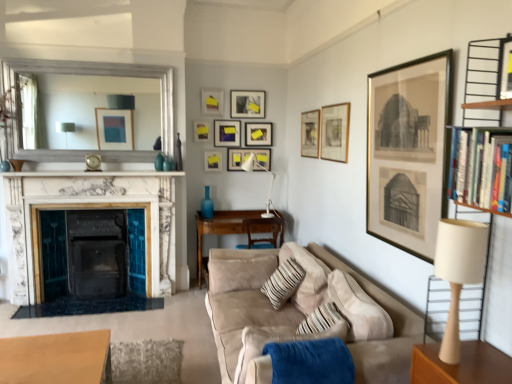
Question: Does hardcover books at right contain wooden frame mirror at upper left?

Choices:
 (A) no
 (B) yes

Answer: (A)

Question: Is hardcover books at right taller than wooden frame mirror at upper left?

Choices:
 (A) no
 (B) yes

Answer: (A)

Question: Is hardcover books at right at the right side of wooden frame mirror at upper left?

Choices:
 (A) no
 (B) yes

Answer: (B)

Question: Is hardcover books at right bigger than wooden frame mirror at upper left?

Choices:
 (A) yes
 (B) no

Answer: (B)

Question: From a real-world perspective, is hardcover books at right physically below wooden frame mirror at upper left?

Choices:
 (A) yes
 (B) no

Answer: (A)

Question: Considering their positions, is white marble fireplace at left located in front of or behind matte black picture frame at upper center, positioned as the 6th picture frame in back-to-front order?

Choices:
 (A) front
 (B) behind

Answer: (A)

Question: From a real-world perspective, relative to matte black picture frame at upper center, positioned as the 6th picture frame in back-to-front order, is white marble fireplace at left vertically above or below?

Choices:
 (A) above
 (B) below

Answer: (B)

Question: From the image's perspective, is white marble fireplace at left located above or below matte black picture frame at upper center, the fifth picture frame when ordered from front to back?

Choices:
 (A) below
 (B) above

Answer: (A)

Question: In terms of height, does white marble fireplace at left look taller or shorter compared to matte black picture frame at upper center, positioned as the 6th picture frame in back-to-front order?

Choices:
 (A) short
 (B) tall

Answer: (B)

Question: Considering the positions of matte black picture frame at upper center, marked as the first picture frame in a back-to-front arrangement, and wooden table at lower left, placed as the 1th table when sorted from front to back, in the image, is matte black picture frame at upper center, marked as the first picture frame in a back-to-front arrangement, taller or shorter than wooden table at lower left, placed as the 1th table when sorted from front to back,?

Choices:
 (A) short
 (B) tall

Answer: (A)

Question: Relative to wooden table at lower left, placed as the 1th table when sorted from front to back, is matte black picture frame at upper center, which is the tenth picture frame in front-to-back order, in front or behind?

Choices:
 (A) behind
 (B) front

Answer: (A)

Question: Looking at their shapes, would you say matte black picture frame at upper center, which is the tenth picture frame in front-to-back order, is wider or thinner than wooden table at lower left, placed as the 2th table when sorted from top to bottom?

Choices:
 (A) wide
 (B) thin

Answer: (B)

Question: Choose the correct answer: Is matte black picture frame at upper center, marked as the first picture frame in a back-to-front arrangement, inside wooden table at lower left, the second table in the back-to-front sequence, or outside it?

Choices:
 (A) outside
 (B) inside

Answer: (A)

Question: Looking at the image, does gold-framed print at upper right, which appears as the tenth picture frame when viewed from the back, seem bigger or smaller compared to matte gold picture frame at upper center, which is counted as the 8th picture frame, starting from the back?

Choices:
 (A) small
 (B) big

Answer: (B)

Question: Is gold-framed print at upper right, which appears as the tenth picture frame when viewed from the back, inside the boundaries of matte gold picture frame at upper center, the 3th picture frame in the front-to-back sequence, or outside?

Choices:
 (A) inside
 (B) outside

Answer: (B)